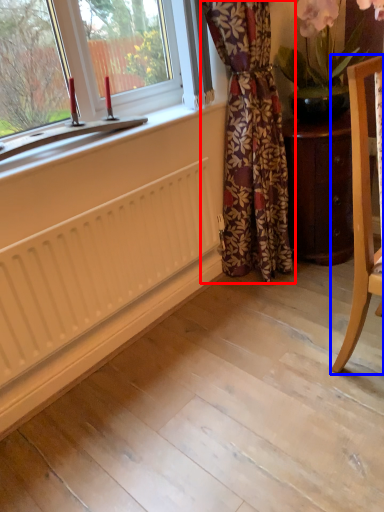
Question: Which point is closer to the camera, curtain (highlighted by a red box) or chair (highlighted by a blue box)?

Choices:
 (A) curtain
 (B) chair

Answer: (B)